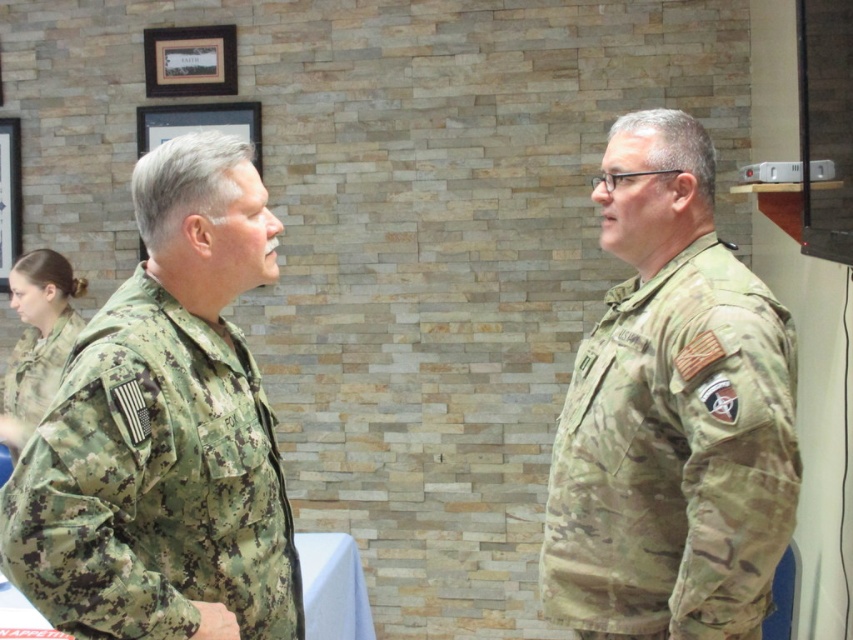
Question: Is camouflage uniform at right above camouflage fabric uniform at lower left?

Choices:
 (A) no
 (B) yes

Answer: (B)

Question: Which of the following is the farthest from the observer?

Choices:
 (A) (41, 444)
 (B) (663, 444)
 (C) (47, 376)
 (D) (344, 588)

Answer: (C)

Question: Is camouflage fabric uniform at left positioned before camouflage fabric uniform at lower left?

Choices:
 (A) no
 (B) yes

Answer: (B)

Question: Where is white fabric table at center located in relation to camouflage fabric uniform at lower left in the image?

Choices:
 (A) below
 (B) above

Answer: (A)

Question: Which of these objects is positioned farthest from the white fabric table at center?

Choices:
 (A) camouflage fabric uniform at lower left
 (B) camouflage uniform at right
 (C) camouflage fabric uniform at left

Answer: (C)

Question: Among these objects, which one is farthest from the camera?

Choices:
 (A) camouflage fabric uniform at left
 (B) camouflage fabric uniform at lower left

Answer: (B)